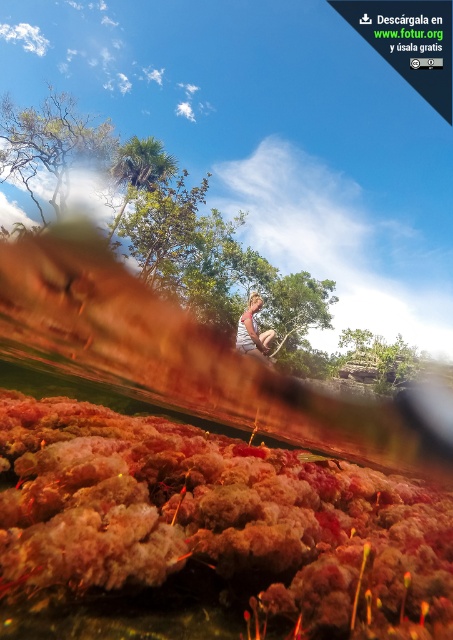
Who is higher up, fuzzy coral at bottom or light brown hair at center?

light brown hair at center

Does fuzzy coral at bottom lie behind light brown hair at center?

No, it is in front of light brown hair at center.

This screenshot has width=453, height=640. What do you see at coordinates (217, 522) in the screenshot?
I see `fuzzy coral at bottom` at bounding box center [217, 522].

Identify the location of fuzzy coral at bottom. Image resolution: width=453 pixels, height=640 pixels. pyautogui.click(x=217, y=522).

Which is above, green leafy tree at upper left or green leafy tree at upper center?

green leafy tree at upper left is above.

Is point (42, 216) farther from camera compared to point (124, 198)?

No, (42, 216) is closer to viewer.

Find the location of a particular element. The image size is (453, 640). green leafy tree at upper left is located at coordinates (49, 145).

Does point (67, 157) come farther from viewer compared to point (264, 362)?

Yes.

Is point (75, 140) closer to viewer compared to point (245, 323)?

No, (75, 140) is further to viewer.

Find the location of `green leafy tree at upper left`. green leafy tree at upper left is located at coordinates coord(49,145).